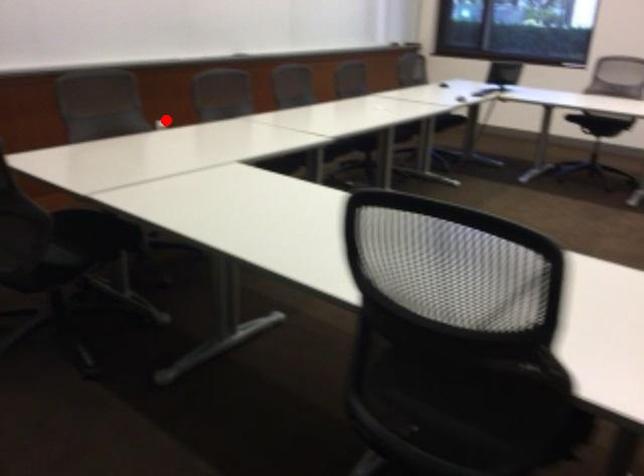
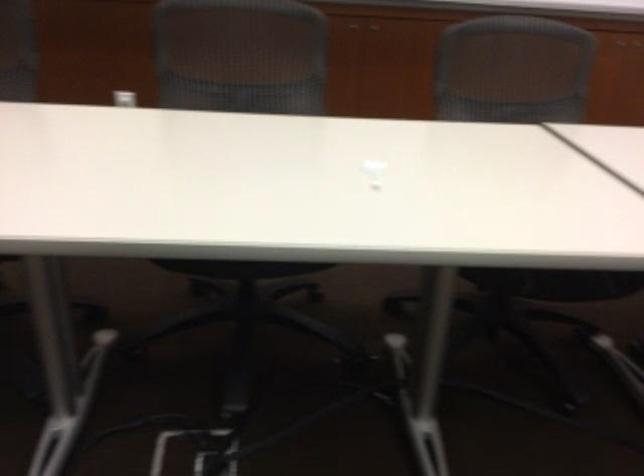
Question: I am providing you with two images of the same scene from different viewpoints. In image1, a red point is highlighted. Considering the same 3D point in image2, which of the following is correct?

Choices:
 (A) It is closer
 (B) It is farther

Answer: (A)